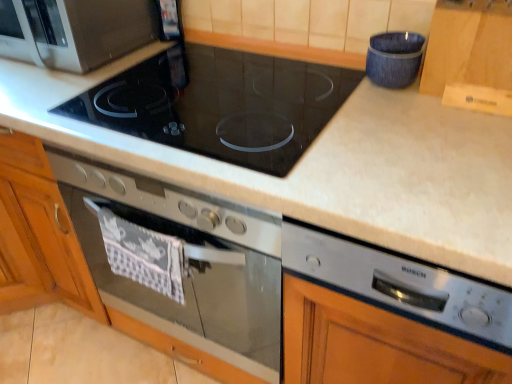
Question: Is blue textured fabric at upper right, positioned as the second appliance in bottom-to-top order, taller than matte black microwave at upper left?

Choices:
 (A) no
 (B) yes

Answer: (A)

Question: Would you say blue textured fabric at upper right, marked as the first appliance in a top-to-bottom arrangement, contains matte black microwave at upper left?

Choices:
 (A) yes
 (B) no

Answer: (B)

Question: Does blue textured fabric at upper right, marked as the first appliance in a top-to-bottom arrangement, have a lesser height compared to matte black microwave at upper left?

Choices:
 (A) yes
 (B) no

Answer: (A)

Question: Is blue textured fabric at upper right, which is counted as the second appliance, starting from the front, outside of matte black microwave at upper left?

Choices:
 (A) no
 (B) yes

Answer: (B)

Question: Is blue textured fabric at upper right, marked as the first appliance in a top-to-bottom arrangement, bigger than matte black microwave at upper left?

Choices:
 (A) no
 (B) yes

Answer: (A)

Question: Considering the positions of satin silver oven at center and satin silver dishwasher at lower right, placed as the second appliance when sorted from top to bottom, in the image, is satin silver oven at center wider or thinner than satin silver dishwasher at lower right, placed as the second appliance when sorted from top to bottom,?

Choices:
 (A) thin
 (B) wide

Answer: (B)

Question: In terms of size, does satin silver oven at center appear bigger or smaller than satin silver dishwasher at lower right, arranged as the 1th appliance when viewed from the front?

Choices:
 (A) big
 (B) small

Answer: (A)

Question: From a real-world perspective, is satin silver oven at center above or below satin silver dishwasher at lower right, placed as the second appliance when sorted from top to bottom?

Choices:
 (A) below
 (B) above

Answer: (A)

Question: Is satin silver oven at center to the left or to the right of satin silver dishwasher at lower right, placed as the second appliance when sorted from top to bottom, in the image?

Choices:
 (A) right
 (B) left

Answer: (B)

Question: Considering their positions, is matte black microwave at upper left located in front of or behind blue textured fabric at upper right, marked as the first appliance in a top-to-bottom arrangement?

Choices:
 (A) behind
 (B) front

Answer: (A)

Question: Looking at their shapes, would you say matte black microwave at upper left is wider or thinner than blue textured fabric at upper right, which is counted as the second appliance, starting from the front?

Choices:
 (A) thin
 (B) wide

Answer: (B)

Question: Is matte black microwave at upper left spatially inside blue textured fabric at upper right, marked as the first appliance in a top-to-bottom arrangement, or outside of it?

Choices:
 (A) inside
 (B) outside

Answer: (B)

Question: From the image's perspective, relative to blue textured fabric at upper right, positioned as the second appliance in bottom-to-top order, is matte black microwave at upper left above or below?

Choices:
 (A) above
 (B) below

Answer: (A)

Question: In terms of size, does black glass cooktop at center appear bigger or smaller than blue textured fabric at upper right, marked as the first appliance in a top-to-bottom arrangement?

Choices:
 (A) big
 (B) small

Answer: (A)

Question: Is black glass cooktop at center taller or shorter than blue textured fabric at upper right, which is counted as the second appliance, starting from the front?

Choices:
 (A) short
 (B) tall

Answer: (A)